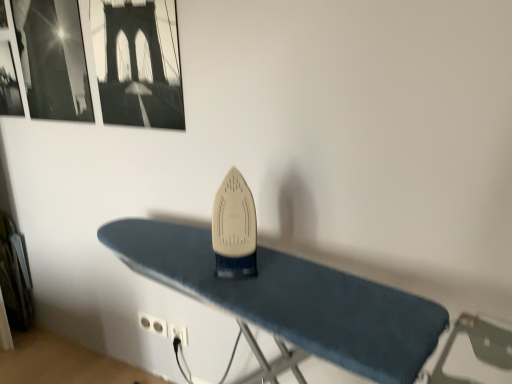
The height and width of the screenshot is (384, 512). Find the location of `vacant space in front of white plastic iron at center`. vacant space in front of white plastic iron at center is located at coordinates (254, 297).